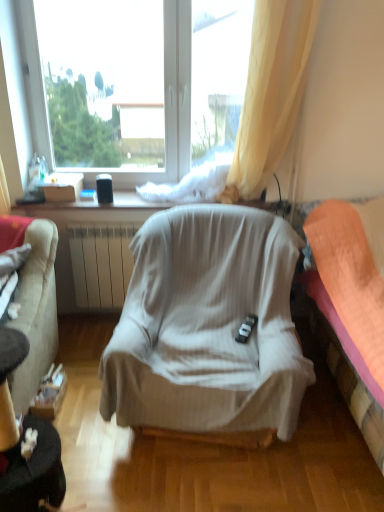
The height and width of the screenshot is (512, 384). Describe the element at coordinates (36, 312) in the screenshot. I see `velvet beige couch at left` at that location.

Image resolution: width=384 pixels, height=512 pixels. Identify the location of white matte window at upper center. (135, 83).

You are a GUI agent. You are given a task and a screenshot of the screen. Output one action in this format:
    pyautogui.click(x=<x>, y=<y>)
    Task: Click on the light beige fabric chair at center
    The image size is (384, 512).
    Given the screenshot: What is the action you would take?
    pyautogui.click(x=208, y=326)

You are a GUI agent. You are given a task and a screenshot of the screen. Output one action in this format:
    pyautogui.click(x=<x>, y=<y>)
    Task: Click on the black plastic remote control at center
    The image size is (384, 512).
    Given the screenshot: What is the action you would take?
    pyautogui.click(x=246, y=328)

Identify the location of white cardboard box at upper left. The height and width of the screenshot is (512, 384). (62, 186).

This screenshot has height=512, width=384. Identify the location of chair lying on the left of orange fabric bed at right. (208, 326).

Is light beige fabric chair at center not within orange fabric bed at right?

light beige fabric chair at center is positioned outside orange fabric bed at right.

Does point (245, 271) come in front of point (370, 234)?

Yes, it is in front of point (370, 234).

I want to click on box lying behind the white matte window at upper center, so click(62, 186).

Which is correct: white cardboard box at upper left is inside white matte window at upper center, or outside of it?

white cardboard box at upper left is located beyond the bounds of white matte window at upper center.

From a real-world perspective, which object rests below the other?

From a 3D spatial view, white cardboard box at upper left is below.

Between white cardboard box at upper left and white matte window at upper center, which one has smaller width?

white matte window at upper center is thinner.

Which object is further away from the camera, black plastic remote control at center or white cardboard box at upper left?

white cardboard box at upper left.

Can you confirm if black plastic remote control at center is shorter than white cardboard box at upper left?

Yes.

Considering the relative sizes of black plastic remote control at center and white cardboard box at upper left in the image provided, is black plastic remote control at center bigger than white cardboard box at upper left?

No, black plastic remote control at center is not bigger than white cardboard box at upper left.

Which is more to the right, black plastic remote control at center or white cardboard box at upper left?

Positioned to the right is black plastic remote control at center.

Is orange fabric bed at right touching white matte window at upper center?

No, orange fabric bed at right is not next to white matte window at upper center.

Can you confirm if orange fabric bed at right is shorter than white matte window at upper center?

Yes.

Does orange fabric bed at right turn towards white matte window at upper center?

No, orange fabric bed at right is not turned towards white matte window at upper center.

How far apart are orange fabric bed at right and white matte window at upper center?

orange fabric bed at right and white matte window at upper center are 1.36 meters apart from each other.

Where is `studio couch behind the orange fabric bed at right`? The image size is (384, 512). studio couch behind the orange fabric bed at right is located at coordinates (36, 312).

In the scene shown: From a real-world perspective, who is located higher, orange fabric bed at right or velvet beige couch at left?

In real-world perspective, velvet beige couch at left is above.

Which of these two, orange fabric bed at right or velvet beige couch at left, is thinner?

With smaller width is velvet beige couch at left.

Can velvet beige couch at left be found inside orange fabric bed at right?

No.

Can you confirm if white cardboard box at upper left is thinner than orange fabric bed at right?

Correct, the width of white cardboard box at upper left is less than that of orange fabric bed at right.

Does point (44, 181) lie behind point (379, 315)?

Yes, it is.

Is white cardboard box at upper left completely or partially outside of orange fabric bed at right?

white cardboard box at upper left is positioned outside orange fabric bed at right.

Is light beige fabric chair at center closer to the viewer compared to white cardboard box at upper left?

Yes.

Consider the image. Which of these two, light beige fabric chair at center or white cardboard box at upper left, is thinner?

With smaller width is white cardboard box at upper left.

The width and height of the screenshot is (384, 512). What are the coordinates of `chair below the white cardboard box at upper left (from a real-world perspective)` in the screenshot? It's located at (208, 326).

Can you confirm if light beige fabric chair at center is shorter than white cardboard box at upper left?

In fact, light beige fabric chair at center may be taller than white cardboard box at upper left.

Find the location of a particular element. The width and height of the screenshot is (384, 512). chair below the orange fabric bed at right (from the image's perspective) is located at coordinates (208, 326).

Locate an element on the screen. This screenshot has width=384, height=512. box on the left of white matte window at upper center is located at coordinates (62, 186).

In the scene shown: Estimate the real-world distances between objects in this image. Which object is closer to black plastic remote control at center, light beige fabric chair at center or white matte window at upper center?

light beige fabric chair at center.

Based on their spatial positions, is white cardboard box at upper left or black plastic remote control at center further from white matte window at upper center?

Based on the image, black plastic remote control at center appears to be further to white matte window at upper center.

Looking at the image, which one is located further to velvet beige couch at left, white cardboard box at upper left or orange fabric bed at right?

orange fabric bed at right is further to velvet beige couch at left.

Estimate the real-world distances between objects in this image. Which object is further from orange fabric bed at right, white matte window at upper center or black plastic remote control at center?

white matte window at upper center is further to orange fabric bed at right.

From the image, which object appears to be nearer to orange fabric bed at right, white matte window at upper center or velvet beige couch at left?

Among the two, white matte window at upper center is located nearer to orange fabric bed at right.

Estimate the real-world distances between objects in this image. Which object is further from white cardboard box at upper left, white matte window at upper center or velvet beige couch at left?

Based on the image, velvet beige couch at left appears to be further to white cardboard box at upper left.

Looking at the image, which one is located further to white matte window at upper center, light beige fabric chair at center or black plastic remote control at center?

The object further to white matte window at upper center is black plastic remote control at center.

Looking at the image, which one is located closer to orange fabric bed at right, white cardboard box at upper left or white matte window at upper center?

The object closer to orange fabric bed at right is white matte window at upper center.

Where is `box located between velvet beige couch at left and black plastic remote control at center in the left-right direction`? Image resolution: width=384 pixels, height=512 pixels. box located between velvet beige couch at left and black plastic remote control at center in the left-right direction is located at coordinates (62, 186).

At what (x,y) coordinates should I click in order to perform the action: click on chair between white cardboard box at upper left and orange fabric bed at right. Please return your answer as a coordinate pair (x, y). Looking at the image, I should click on (208, 326).

This screenshot has width=384, height=512. What are the coordinates of `box between white matte window at upper center and black plastic remote control at center from top to bottom` in the screenshot? It's located at (x=62, y=186).

What are the coordinates of `remote control between white cardboard box at upper left and orange fabric bed at right in the horizontal direction` in the screenshot? It's located at (246, 328).